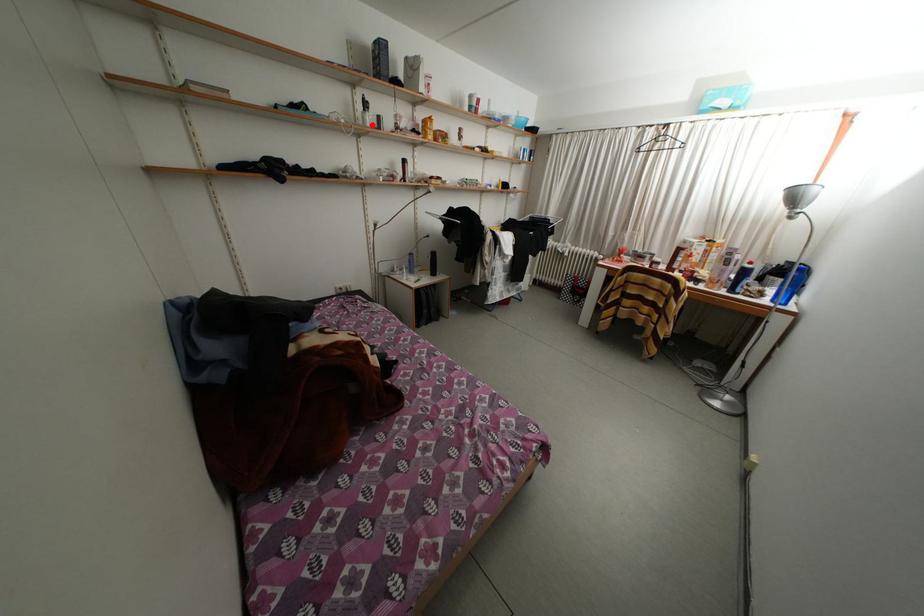
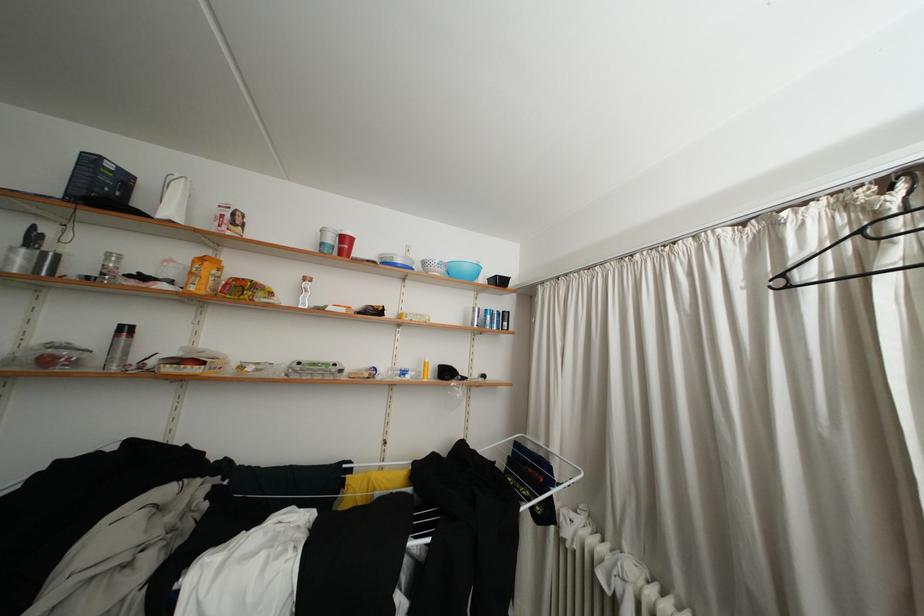
Locate, in the second image, the point that corresponds to the highlighted location in the first image.

(17, 264)